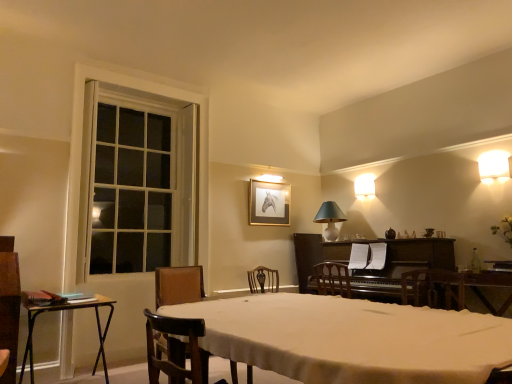
Question: Relative to matte white lampshade at upper right, the second lamp from the bottom, is metallic gold picture frame at upper center in front or behind?

Choices:
 (A) behind
 (B) front

Answer: (B)

Question: Looking at their shapes, would you say metallic gold picture frame at upper center is wider or thinner than matte white lampshade at upper right, the second lamp from the bottom?

Choices:
 (A) thin
 (B) wide

Answer: (A)

Question: Estimate the real-world distances between objects in this image. Which object is closer to the metallic gold picture frame at upper center?

Choices:
 (A) white glossy wall sconce at upper right, the 3th lamp in the left-to-right sequence
 (B) brown leather chair at lower left
 (C) white wood window at left
 (D) white ceramic lampshade at upper center, the 1th lamp when ordered from left to right
 (E) matte white lampshade at upper right, which appears as the second lamp when viewed from the left

Answer: (D)

Question: Considering the real-world distances, which object is farthest from the clear glass bottle at right?

Choices:
 (A) metallic black table at left
 (B) metallic gold picture frame at upper center
 (C) brown leather chair at lower left
 (D) white glossy wall sconce at upper right, the first lamp viewed from the top
 (E) matte white lampshade at upper right, which appears as the 2th lamp when viewed from the top

Answer: (A)